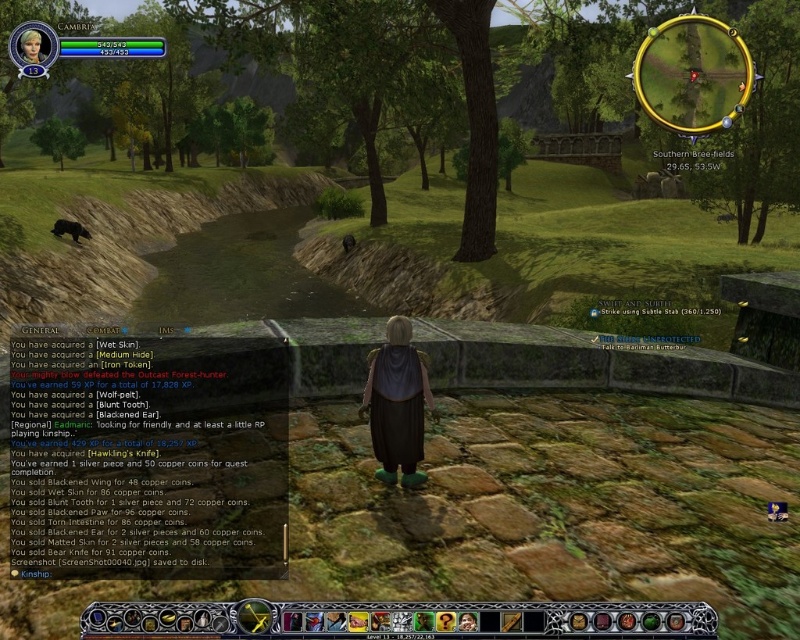
Looking at this image, you are a character in an RPG game and you need to check your inventory. You see the matte black cloak at center and the blonde hair at upper left. Which object is positioned to the right of the other?

The matte black cloak at center is to the right of blonde hair at upper left.

You are a character in an RPG game and notice a matte black cloak at center. Can you determine its exact location using the coordinate system provided?

The matte black cloak at center is located at coordinate point (397,403).